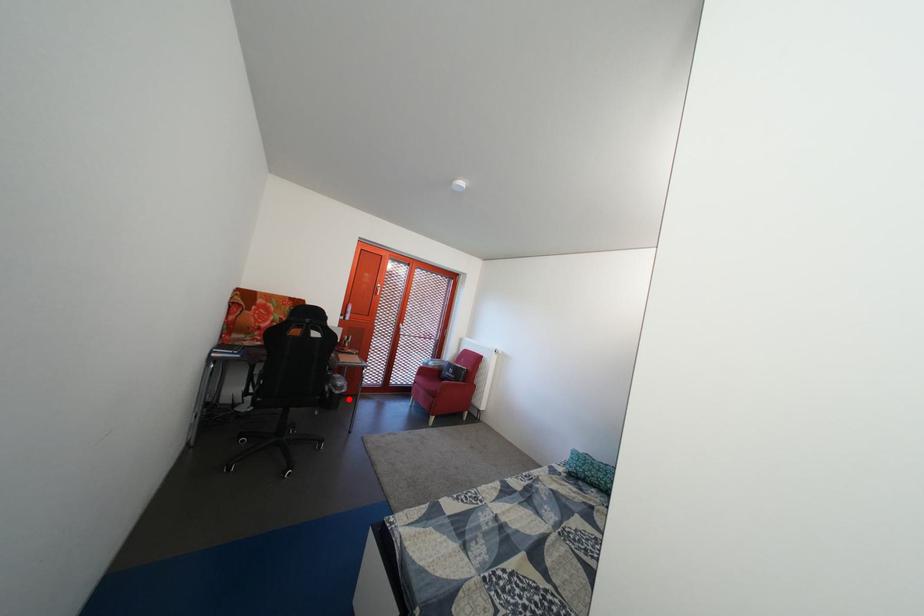
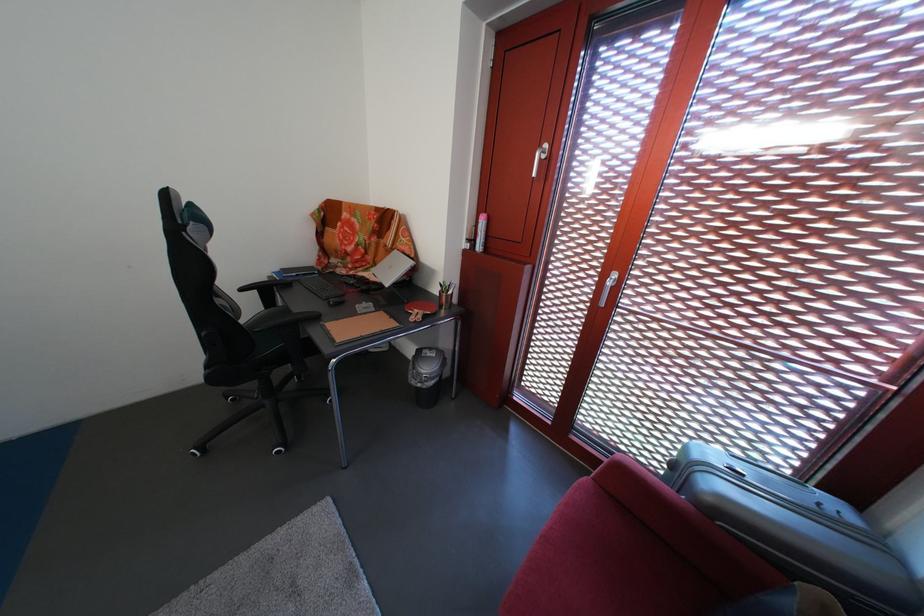
Question: I am providing you with two images of the same scene from different viewpoints. Given a red point in image1, look at the same physical point in image2. Is it:

Choices:
 (A) Closer to the viewpoint
 (B) Farther from the viewpoint

Answer: (B)